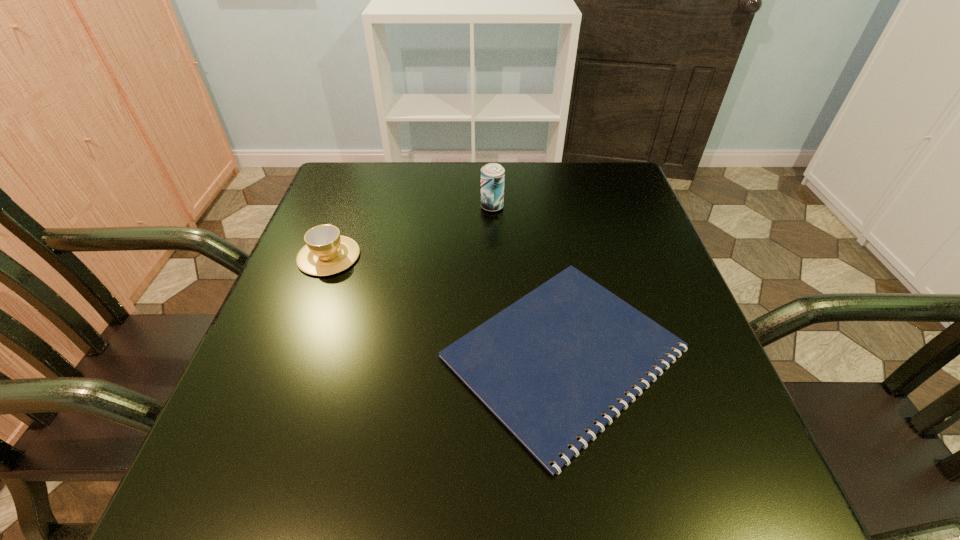
Locate an element on the screen. The image size is (960, 540). the farthest object is located at coordinates (492, 175).

Identify the location of the tallest object. The height and width of the screenshot is (540, 960). (492, 175).

The image size is (960, 540). In order to click on cup in this screenshot , I will do `click(326, 252)`.

The width and height of the screenshot is (960, 540). In order to click on the second shortest object in this screenshot , I will do `click(326, 252)`.

The width and height of the screenshot is (960, 540). Identify the location of the shortest object. (548, 366).

The image size is (960, 540). I want to click on vacant space located 0.380m on the front of the farthest object, so click(496, 334).

I want to click on vacant space situated with the handle on the side of the second tallest object, so click(x=355, y=185).

I want to click on free space located 0.160m with the handle on the side of the second tallest object, so pos(350,198).

At what (x,y) coordinates should I click in order to perform the action: click on vacant space situated 0.120m with the handle on the side of the second tallest object. Please return your answer as a coordinate pair (x, y). Image resolution: width=960 pixels, height=540 pixels. Looking at the image, I should click on (348, 207).

This screenshot has height=540, width=960. I want to click on vacant space located 0.310m on the left of the shortest object, so click(265, 353).